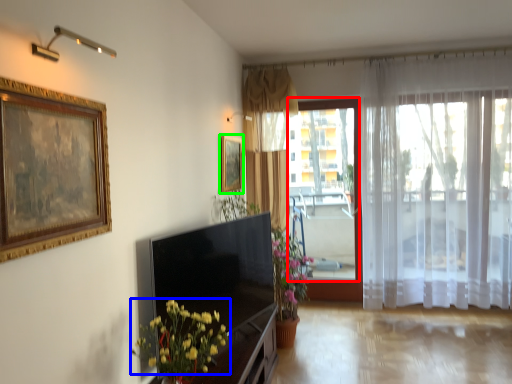
Question: Considering the real-world distances, which object is farthest from window screen (highlighted by a red box)? flower (highlighted by a blue box) or picture frame (highlighted by a green box)?

Choices:
 (A) flower
 (B) picture frame

Answer: (A)